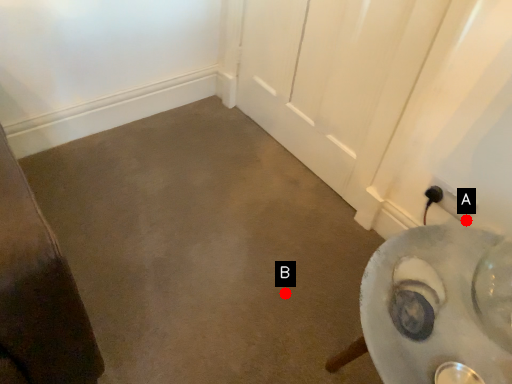
Question: Two points are circled on the image, labeled by A and B beside each circle. Which point appears closest to the camera in this image?

Choices:
 (A) A is closer
 (B) B is closer

Answer: (A)